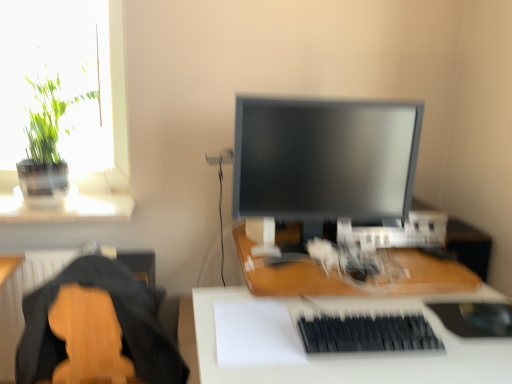
What are the coordinates of `free spot above black rubber mousepad at lower right (from a real-world perspective)` in the screenshot? It's located at (480, 308).